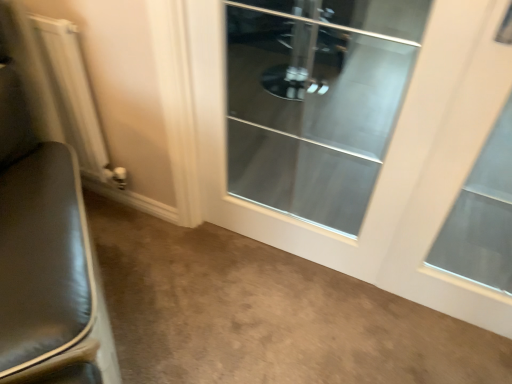
Question: From a real-world perspective, is clear glass door at center located higher than white metallic radiator at left?

Choices:
 (A) yes
 (B) no

Answer: (A)

Question: From the image's perspective, is clear glass door at center beneath white metallic radiator at left?

Choices:
 (A) no
 (B) yes

Answer: (B)

Question: Is clear glass door at center positioned beyond the bounds of white metallic radiator at left?

Choices:
 (A) yes
 (B) no

Answer: (A)

Question: Can you confirm if clear glass door at center is wider than white metallic radiator at left?

Choices:
 (A) yes
 (B) no

Answer: (A)

Question: Is clear glass door at center looking in the opposite direction of white metallic radiator at left?

Choices:
 (A) yes
 (B) no

Answer: (B)

Question: Does clear glass door at center have a larger size compared to white metallic radiator at left?

Choices:
 (A) yes
 (B) no

Answer: (A)

Question: Is there a large distance between clear glass door at center and white metallic radiator at left?

Choices:
 (A) yes
 (B) no

Answer: (A)

Question: Does clear glass door at center have a greater height compared to white metallic radiator at left?

Choices:
 (A) yes
 (B) no

Answer: (A)

Question: From the image's perspective, does clear glass door at center appear lower than white metallic radiator at left?

Choices:
 (A) yes
 (B) no

Answer: (A)

Question: Is clear glass door at center closer to the viewer compared to white metallic radiator at left?

Choices:
 (A) no
 (B) yes

Answer: (B)

Question: From a real-world perspective, is clear glass door at center below white metallic radiator at left?

Choices:
 (A) yes
 (B) no

Answer: (B)

Question: Is clear glass door at center bigger than white metallic radiator at left?

Choices:
 (A) yes
 (B) no

Answer: (B)

Question: Does clear glass door at center appear on the left side of clear glass door at center?

Choices:
 (A) no
 (B) yes

Answer: (A)